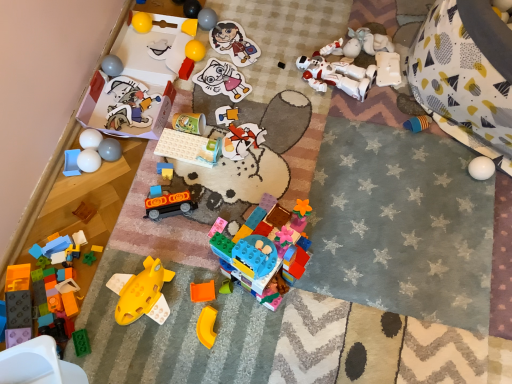
This screenshot has width=512, height=384. In order to click on vacant region in front of white plastic robot at upper right, which appears as the second toy when viewed from the right in this screenshot , I will do `click(386, 118)`.